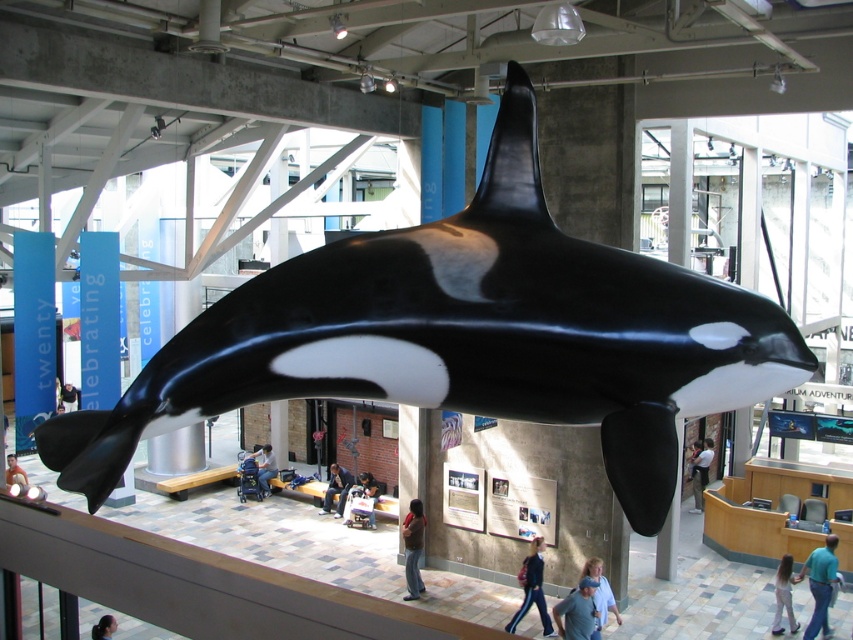
Can you confirm if light blue jeans at lower right is wider than blue denim jeans at lower center?

No.

Which is more to the right, light blue jeans at lower right or blue denim jeans at lower center?

light blue jeans at lower right is more to the right.

Is point (780, 600) more distant than point (596, 564)?

Yes.

The height and width of the screenshot is (640, 853). What are the coordinates of `light blue jeans at lower right` in the screenshot? It's located at (784, 595).

The image size is (853, 640). What do you see at coordinates (820, 584) in the screenshot? I see `green matte shirt at lower right` at bounding box center [820, 584].

At what (x,y) coordinates should I click in order to perform the action: click on green matte shirt at lower right. Please return your answer as a coordinate pair (x, y). The width and height of the screenshot is (853, 640). Looking at the image, I should click on (820, 584).

Which of these two, light blue jeans at lower right or denim jacket at center, stands shorter?

Standing shorter between the two is denim jacket at center.

You are a GUI agent. You are given a task and a screenshot of the screen. Output one action in this format:
    pyautogui.click(x=<x>, y=<y>)
    Task: Click on the light blue jeans at lower right
    
    Given the screenshot: What is the action you would take?
    pyautogui.click(x=784, y=595)

The height and width of the screenshot is (640, 853). What do you see at coordinates (784, 595) in the screenshot? I see `light blue jeans at lower right` at bounding box center [784, 595].

Find the location of a particular element. The height and width of the screenshot is (640, 853). light blue jeans at lower right is located at coordinates (784, 595).